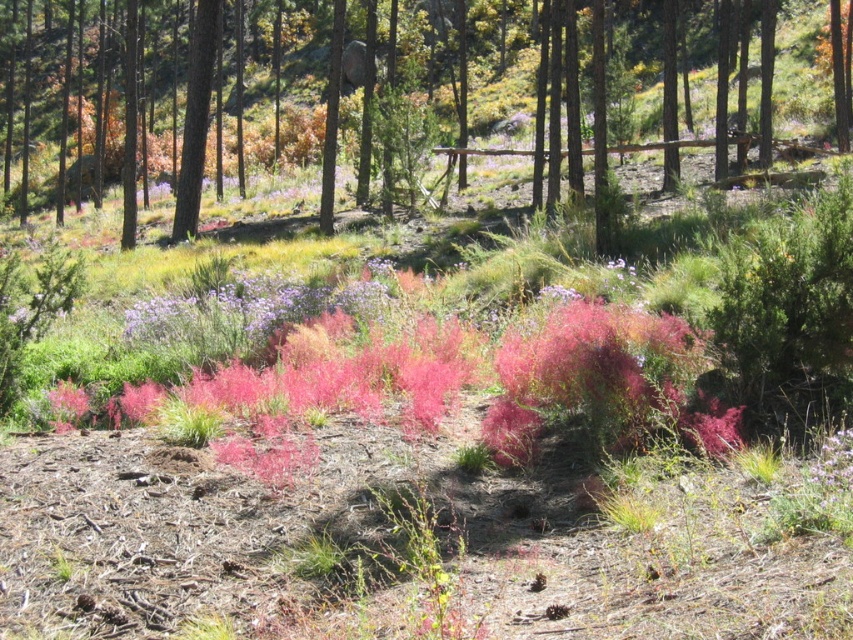
In the scene shown: Who is more forward, [598,225] or [171,241]?

Point [598,225] is in front.

Can you confirm if smooth bark tree at center is positioned above green matte tree at center?

Correct, smooth bark tree at center is located above green matte tree at center.

Locate an element on the screen. Image resolution: width=853 pixels, height=640 pixels. smooth bark tree at center is located at coordinates (563, 108).

Looking at this image, which is above, smooth bark tree at center or pink fluffy plant at center?

smooth bark tree at center is above.

Can you confirm if smooth bark tree at center is positioned above pink fluffy plant at center?

Yes.

The height and width of the screenshot is (640, 853). Describe the element at coordinates (563, 108) in the screenshot. I see `smooth bark tree at center` at that location.

The width and height of the screenshot is (853, 640). I want to click on smooth bark tree at center, so click(x=563, y=108).

Is pink fluffy plant at center smaller than green matte tree at center?

Yes, pink fluffy plant at center is smaller than green matte tree at center.

Between pink fluffy plant at center and green matte tree at center, which one has less height?

pink fluffy plant at center

Which is behind, point (596, 364) or point (193, 196)?

Positioned behind is point (193, 196).

Identify the location of pink fluffy plant at center. This screenshot has height=640, width=853. (599, 385).